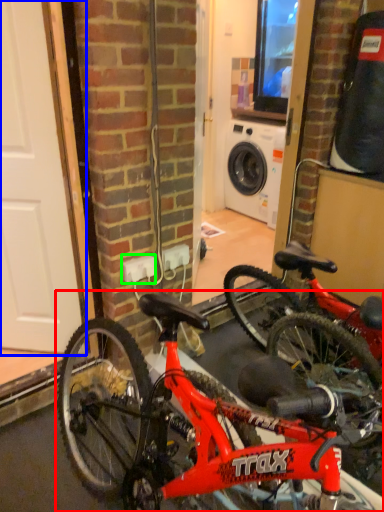
Question: Which is farther away from bicycle (highlighted by a red box)? door (highlighted by a blue box) or electric outlet (highlighted by a green box)?

Choices:
 (A) door
 (B) electric outlet

Answer: (A)